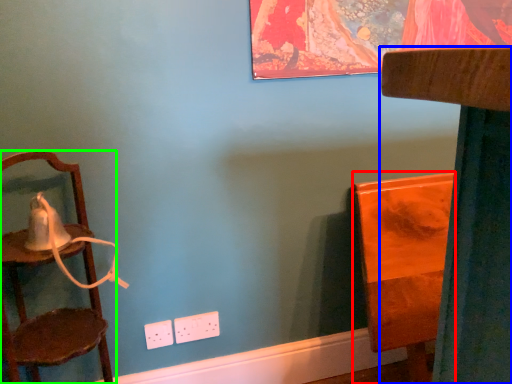
Question: Which is farther away from furniture (highlighted by a red box)? furniture (highlighted by a blue box) or chair (highlighted by a green box)?

Choices:
 (A) furniture
 (B) chair

Answer: (B)